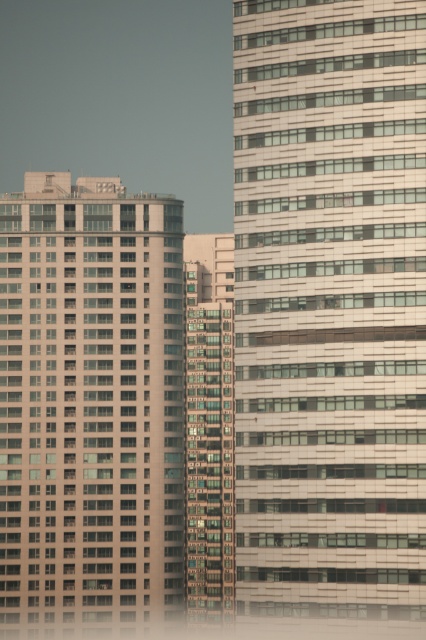
You are standing in the city looking at the two buildings. There are two points marked on the buildings. The first point is at coordinate point (x=161, y=508) and the second is at point (x=218, y=241). Which point is closer to you?

Point (x=161, y=508) is closer to the viewer than point (x=218, y=241).

You are a city planner analyzing the urban layout. Given the white glass building at center and the glassy reflective windows at center, which one has a greater width when viewed from the street level?

The white glass building at center has a greater width than the glassy reflective windows at center, as its width surpasses that of the windows.

In the scene shown: You are standing in the city looking at the two buildings. There are two points marked on the buildings. The first point is at coordinates point [406,280] and the second is at point [218,540]. Which point is closer to you?

Point [406,280] is closer to the camera than point [218,540].